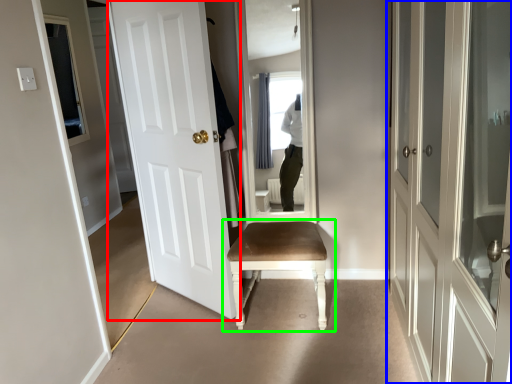
Question: Estimate the real-world distances between objects in this image. Which object is farther from door (highlighted by a red box), door (highlighted by a blue box) or chair (highlighted by a green box)?

Choices:
 (A) door
 (B) chair

Answer: (A)